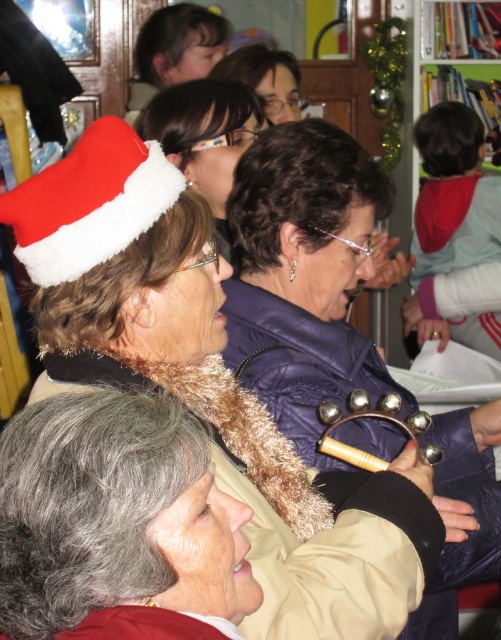
You are a photographer trying to capture a clear photo of both the red velvet santa hat at upper left and the matte black santa hat at upper center. However, you notice that one of them is blocking the view of the other. Which hat is blocking the other one?

The red velvet santa hat at upper left is in front of matte black santa hat at upper center, so it is blocking the view of the matte black santa hat at upper center.

You are standing in the center of the scene and want to find the purple fuzzy jacket at center. According to the spatial coordinates provided, in which direction should you look to locate it?

The purple fuzzy jacket at center is located at point coordinates 0.431 along the horizontal axis and 0.607 along the vertical axis. Since you are standing in the center, you should look slightly to the right and upwards to find it.

You are an observer standing in front of the scene. You notice the red velvet santa hat at upper left and the matte purple jacket at center. Which object is shorter in height?

The red velvet santa hat at upper left has a lesser height compared to the matte purple jacket at center, so the red velvet santa hat at upper left is shorter in height.